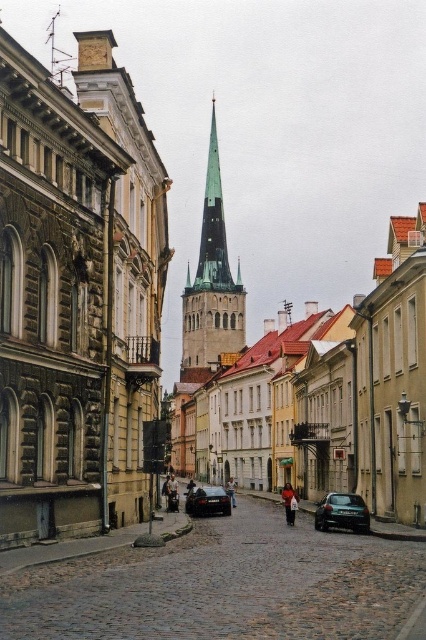
In the scene shown: Does shiny dark blue car at center have a lesser width compared to denim jacket at center?

No.

Is shiny dark blue car at center to the right of denim jacket at center from the viewer's perspective?

Yes, shiny dark blue car at center is to the right of denim jacket at center.

Find the location of a particular element. The width and height of the screenshot is (426, 640). shiny dark blue car at center is located at coordinates (342, 513).

Where is `stone tower at center`? The image size is (426, 640). stone tower at center is located at coordinates click(77, 294).

How distant is stone tower at center from dark blue jeans at center?

A distance of 25.37 meters exists between stone tower at center and dark blue jeans at center.

Which is behind, point (62, 212) or point (192, 484)?

Point (192, 484)

At what (x,y) coordinates should I click in order to perform the action: click on stone tower at center. Please return your answer as a coordinate pair (x, y). The width and height of the screenshot is (426, 640). Looking at the image, I should click on (77, 294).

Is red fabric coat at center thinner than denim jacket at center?

Incorrect, red fabric coat at center's width is not less than denim jacket at center's.

Is point (291, 493) in front of point (230, 497)?

Yes, it is.

I want to click on red fabric coat at center, so click(x=288, y=502).